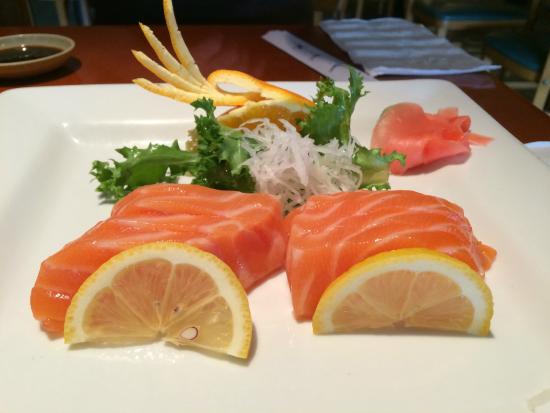
In order to click on wooden table in this screenshot , I will do [125, 59].